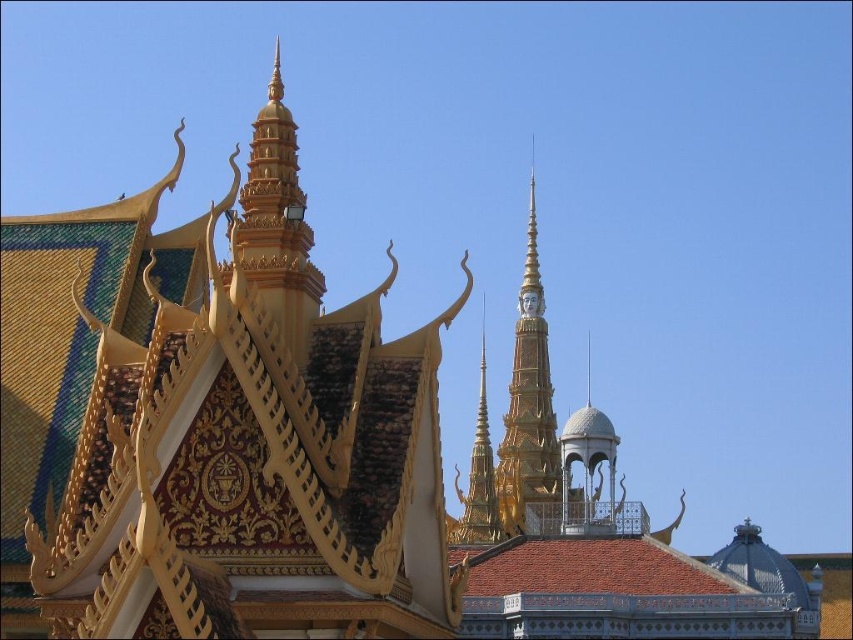
Is gold/gilded stupa at center further to camera compared to gold textured spire at center?

That is False.

Is gold/gilded stupa at center wider than gold textured spire at center?

Yes.

Between point (556, 458) and point (445, 516), which one is positioned behind?

The point (556, 458) is more distant.

Locate an element on the screen. Image resolution: width=853 pixels, height=640 pixels. gold/gilded stupa at center is located at coordinates (527, 401).

Which of these two, gold/gilded spire at upper center or gold/gilded stupa at center, stands taller?

gold/gilded stupa at center

Is gold/gilded spire at upper center thinner than gold/gilded stupa at center?

No, gold/gilded spire at upper center is not thinner than gold/gilded stupa at center.

Find the location of a particular element. The image size is (853, 640). gold/gilded spire at upper center is located at coordinates (277, 221).

Where is `gold/gilded spire at upper center`? gold/gilded spire at upper center is located at coordinates (277, 221).

In the scene shown: Does gold/gilded spire at upper center have a larger size compared to gold textured spire at center?

Indeed, gold/gilded spire at upper center has a larger size compared to gold textured spire at center.

Between gold/gilded spire at upper center and gold textured spire at center, which one is positioned higher?

gold/gilded spire at upper center is higher up.

Between point (288, 339) and point (490, 506), which one is positioned in front?

Point (288, 339) is in front.

Where is `gold/gilded spire at upper center`? This screenshot has width=853, height=640. gold/gilded spire at upper center is located at coordinates (277, 221).